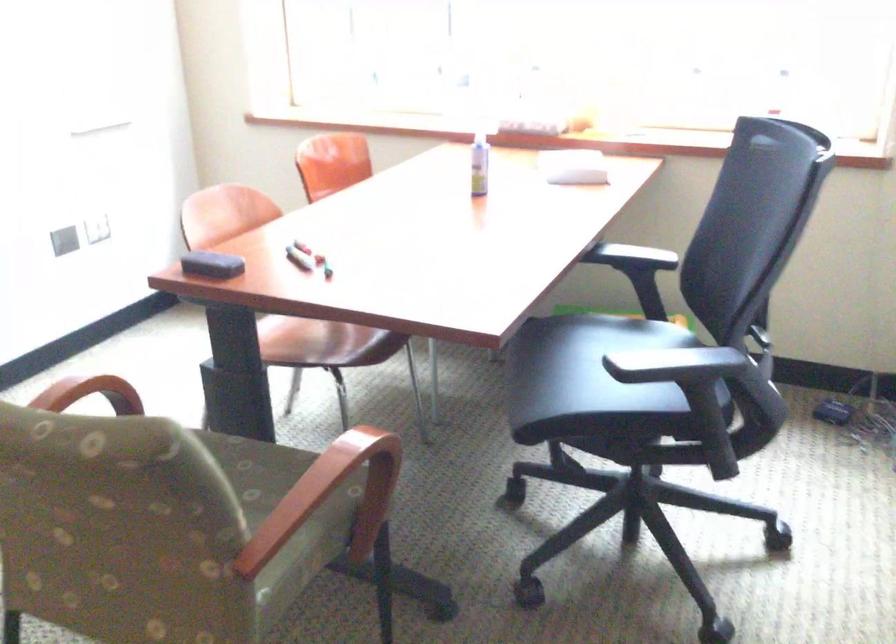
I want to click on black chair sitting surface, so click(x=591, y=361).